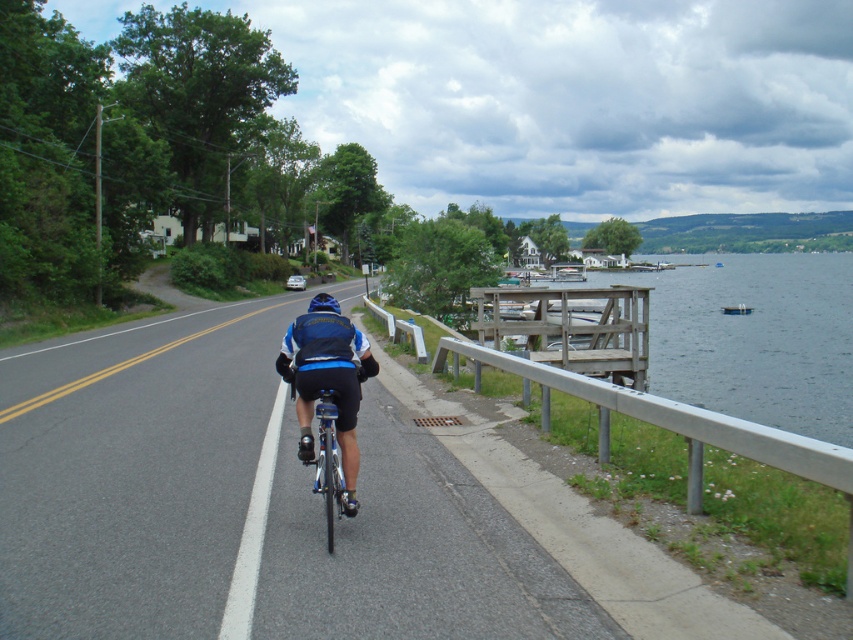
You are a cyclist planning to ride through the gray asphalt bike lane at center while wearing the blue matte helmet at center. Can you tell me which object takes up more space in the image?

The blue matte helmet at center takes up more space in the image than the gray asphalt bike lane at center, as the gray asphalt bike lane at center is smaller than the blue matte helmet at center.